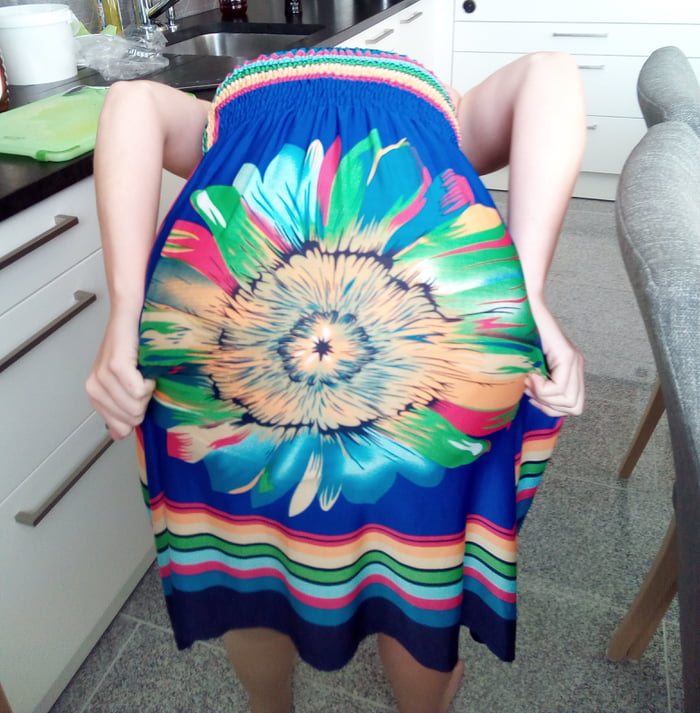
This screenshot has width=700, height=713. In order to click on chair in this screenshot , I will do `click(682, 356)`.